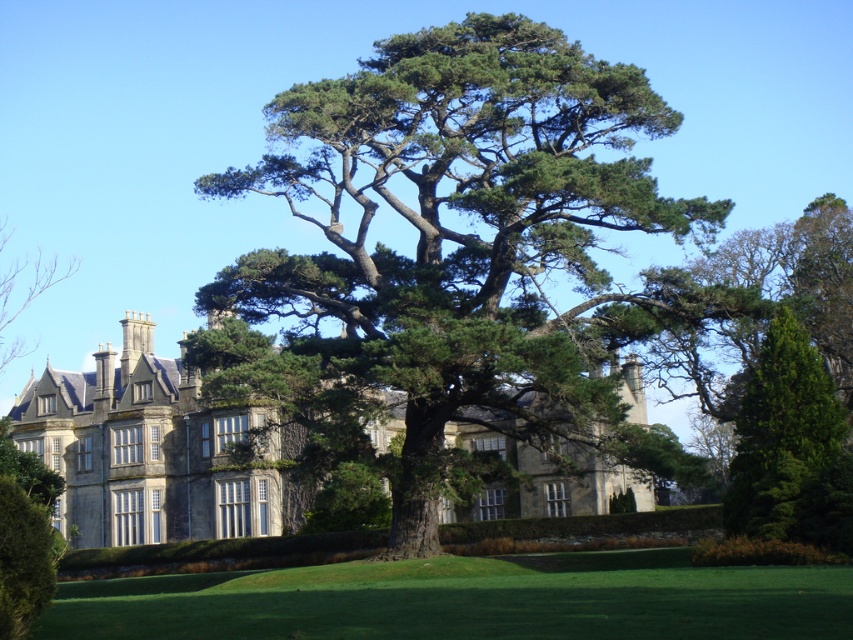
Is point (96, 461) positioned after point (701, 563)?

Yes, point (96, 461) is farther from viewer.

Who is taller, stone mansion at center or green leafy hedge at lower right?

With more height is stone mansion at center.

Identify the location of stone mansion at center. (154, 451).

At what (x,y) coordinates should I click in order to perform the action: click on stone mansion at center. Please return your answer as a coordinate pair (x, y). This screenshot has width=853, height=640. Looking at the image, I should click on (154, 451).

Does green matte evergreen tree at center have a greater height compared to green leafy hedge at lower right?

Correct, green matte evergreen tree at center is much taller as green leafy hedge at lower right.

Does green matte evergreen tree at center come in front of green leafy hedge at lower right?

Yes, green matte evergreen tree at center is in front of green leafy hedge at lower right.

You are a GUI agent. You are given a task and a screenshot of the screen. Output one action in this format:
    pyautogui.click(x=<x>, y=<y>)
    Task: Click on the green matte evergreen tree at center
    
    Given the screenshot: What is the action you would take?
    (790, 448)

Is green textured tree at center closer to the viewer compared to green leafy hedge at lower right?

No, it is not.

Is green textured tree at center bigger than green leafy hedge at lower right?

Indeed, green textured tree at center has a larger size compared to green leafy hedge at lower right.

The image size is (853, 640). Find the location of `green textured tree at center`. green textured tree at center is located at coordinates (459, 248).

You are a GUI agent. You are given a task and a screenshot of the screen. Output one action in this format:
    pyautogui.click(x=<x>, y=<y>)
    Task: Click on the green textured tree at center
    This screenshot has height=640, width=853.
    Given the screenshot: What is the action you would take?
    pyautogui.click(x=459, y=248)